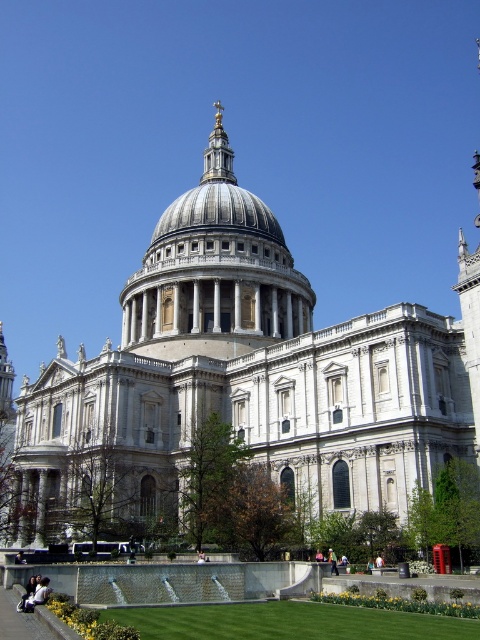
You are standing at the point marked by the coordinates point (243, 378) in the image of St. Pauls Cathedral. What is the color of the building you are standing on?

The point (243, 378) marks white stone cathedral at center, so the building you are standing on is white stone.

You are a tourist standing in front of the white stone cathedral at center and the silver metallic dome at center. Which one do you see as larger in size?

The white stone cathedral at center is bigger than the silver metallic dome at center, so you see the white stone cathedral at center as larger in size.